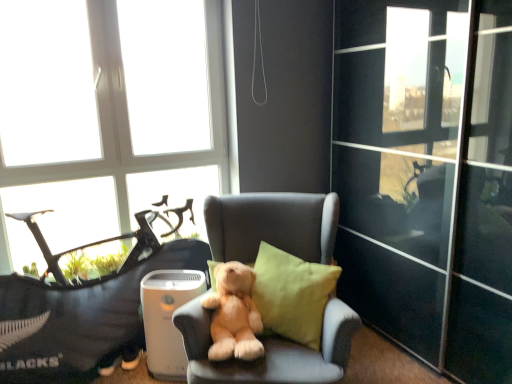
Question: Considering the relative sizes of transparent glass window at upper left and soft plush bear at center in the image provided, is transparent glass window at upper left taller than soft plush bear at center?

Choices:
 (A) no
 (B) yes

Answer: (B)

Question: Does transparent glass window at upper left have a smaller size compared to soft plush bear at center?

Choices:
 (A) no
 (B) yes

Answer: (A)

Question: Is soft plush bear at center surrounded by transparent glass window at upper left?

Choices:
 (A) yes
 (B) no

Answer: (B)

Question: Is transparent glass window at upper left facing away from soft plush bear at center?

Choices:
 (A) no
 (B) yes

Answer: (A)

Question: Is transparent glass window at upper left in front of soft plush bear at center?

Choices:
 (A) yes
 (B) no

Answer: (B)

Question: Considering the positions of soft fabric teddy bear at center and soft gray armchair at center in the image, is soft fabric teddy bear at center taller or shorter than soft gray armchair at center?

Choices:
 (A) short
 (B) tall

Answer: (A)

Question: Considering their positions, is soft fabric teddy bear at center located in front of or behind soft gray armchair at center?

Choices:
 (A) front
 (B) behind

Answer: (B)

Question: Based on their sizes in the image, would you say soft fabric teddy bear at center is bigger or smaller than soft gray armchair at center?

Choices:
 (A) small
 (B) big

Answer: (A)

Question: Looking at their shapes, would you say soft fabric teddy bear at center is wider or thinner than soft gray armchair at center?

Choices:
 (A) wide
 (B) thin

Answer: (B)

Question: From the image's perspective, is soft gray armchair at center located above or below transparent glass window at upper left?

Choices:
 (A) below
 (B) above

Answer: (A)

Question: In the image, is soft gray armchair at center positioned in front of or behind transparent glass window at upper left?

Choices:
 (A) behind
 (B) front

Answer: (B)

Question: Considering the positions of soft gray armchair at center and transparent glass window at upper left in the image, is soft gray armchair at center wider or thinner than transparent glass window at upper left?

Choices:
 (A) thin
 (B) wide

Answer: (B)

Question: In terms of height, does soft gray armchair at center look taller or shorter compared to transparent glass window at upper left?

Choices:
 (A) short
 (B) tall

Answer: (A)

Question: From a real-world perspective, is soft gray armchair at center positioned above or below linen cushion at center?

Choices:
 (A) below
 (B) above

Answer: (A)

Question: Choose the correct answer: Is soft gray armchair at center inside linen cushion at center or outside it?

Choices:
 (A) outside
 (B) inside

Answer: (A)